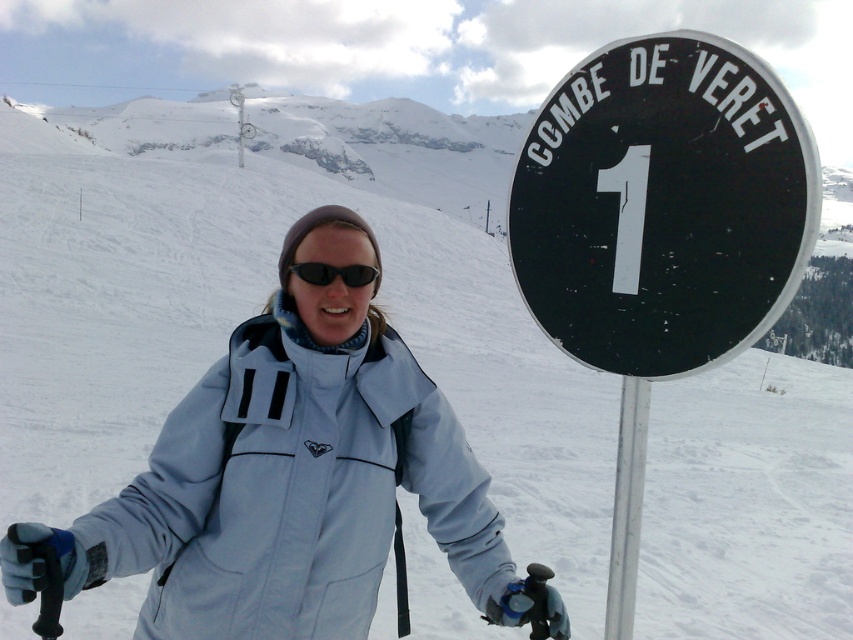
Question: Which of the following is the closest to the observer?

Choices:
 (A) black plastic sign at upper right
 (B) black matte sunglasses at center

Answer: (A)

Question: Is black plastic sign at upper right above black matte sunglasses at center?

Choices:
 (A) yes
 (B) no

Answer: (A)

Question: Among these points, which one is farthest from the camera?

Choices:
 (A) (316, 262)
 (B) (682, 275)

Answer: (A)

Question: Is black plastic sign at upper right positioned before black matte sunglasses at center?

Choices:
 (A) yes
 (B) no

Answer: (A)

Question: Can you confirm if black plastic sign at upper right is positioned above black matte sunglasses at center?

Choices:
 (A) yes
 (B) no

Answer: (A)